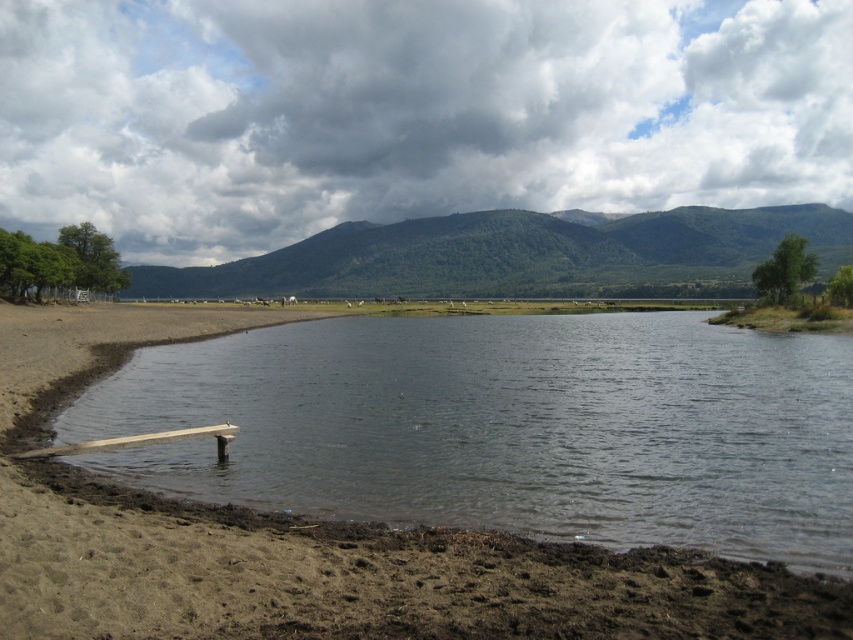
You are a hiker who wants to take a photo of the green forested mountain at center from the brown sandy beach at lower left. Considering their sizes, which object should you focus on to ensure the mountain fills most of your camera frame?

The brown sandy beach at lower left has a smaller size compared to green forested mountain at center. To ensure the green forested mountain at center fills most of your camera frame, you should focus on the green forested mountain at center since it is larger and will occupy more space in the photo.

You are standing on the brown sandy beach at lower left and want to reach the green forested mountain at center. Which direction should you move to get closer to the mountain?

You should move towards the direction away from the brown sandy beach at lower left since it is in front of the green forested mountain at center, meaning the mountain is behind the beach from your current position.